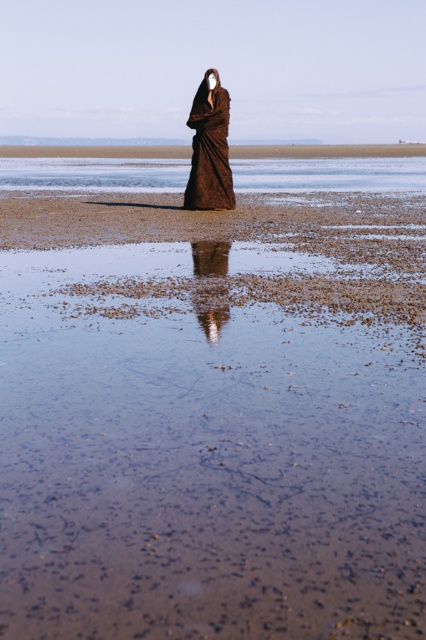
You are a photographer trying to capture the reflection of the smooth brown hair at center in the clear water at center. Based on the scene, will the reflection be visible in the water?

The clear water at center is further to the viewer than smooth brown hair at center. Since the water is closer to the photographer, the reflection of the smooth brown hair at center would not be visible in the clear water at center because the hair is behind the water from the photographer perspective.

You are a photographer trying to capture the reflection of the solitary figure on the beach. Since you want to focus on the smooth brown hair at center, should you position yourself in front of or behind the brown textured robe at center to ensure the hair is clearly visible in the reflection?

The smooth brown hair at center is behind the brown textured robe at center, so positioning yourself in front of the robe would allow you to see the hair reflected in the water without obstruction from the robe.

You are a photographer trying to capture the reflection of the solitary figure in the water. Since the brown textured robe at center and smooth brown hair at center are both visible in the reflection, which part of the figure will appear taller in the reflection?

The brown textured robe at center will appear taller in the reflection because it is much taller than the smooth brown hair at center in reality, so its reflection would naturally be proportionally taller as well.